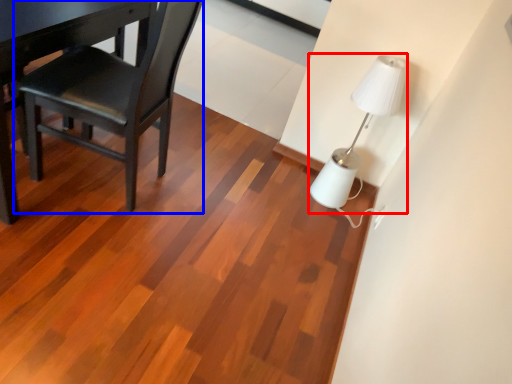
Question: Which point is further to the camera, lamp (highlighted by a red box) or chair (highlighted by a blue box)?

Choices:
 (A) lamp
 (B) chair

Answer: (A)